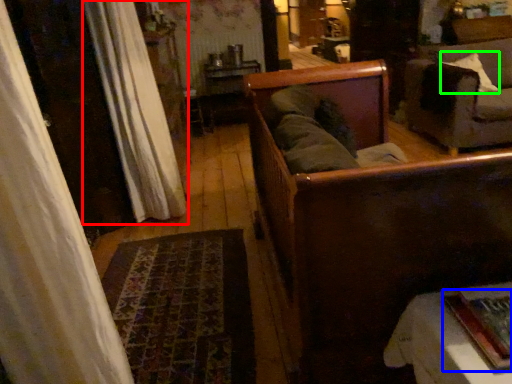
Question: Which is nearer to the curtain (highlighted by a red box)? book (highlighted by a blue box) or pillow (highlighted by a green box).

Choices:
 (A) book
 (B) pillow

Answer: (A)